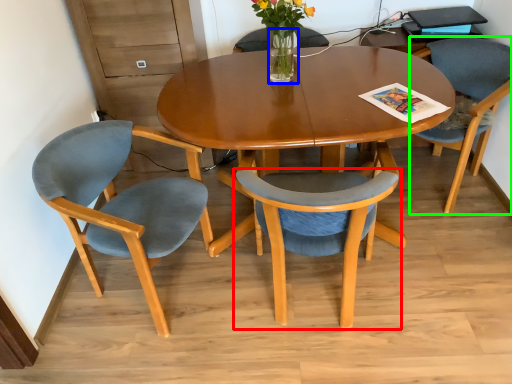
Question: Estimate the real-world distances between objects in this image. Which object is farther from chair (highlighted by a red box), vase (highlighted by a blue box) or chair (highlighted by a green box)?

Choices:
 (A) vase
 (B) chair

Answer: (B)